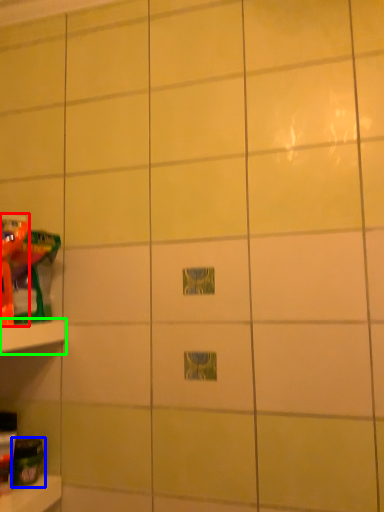
Question: Based on their relative distances, which object is farther from toy (highlighted by a red box)? Choose from toy (highlighted by a blue box) and shelf (highlighted by a green box).

Choices:
 (A) toy
 (B) shelf

Answer: (A)